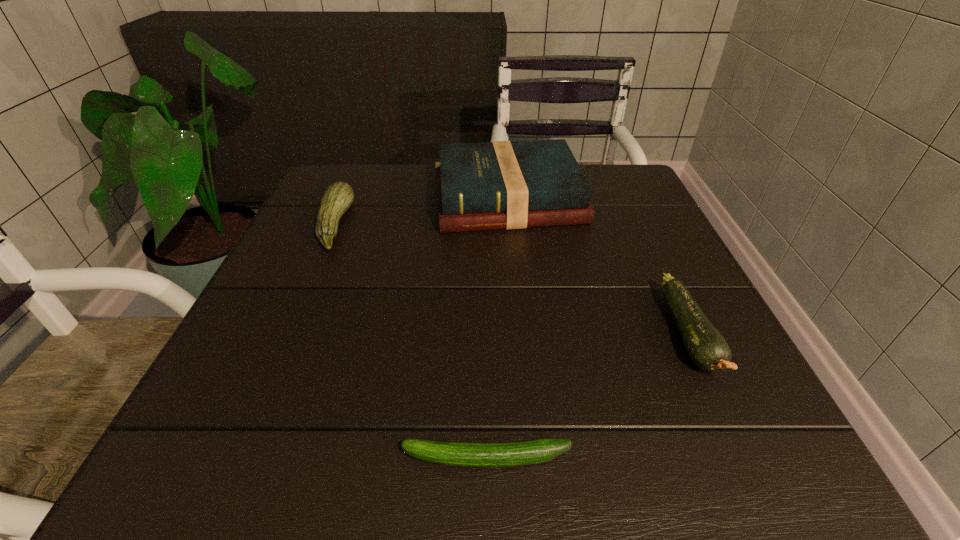
Locate an element on the screen. The height and width of the screenshot is (540, 960). blank region between the third farthest object and the hardback book is located at coordinates point(598,267).

The width and height of the screenshot is (960, 540). In order to click on empty space that is in between the shortest object and the hardback book in this screenshot , I will do `click(497, 328)`.

Where is `vacant space that is in between the tallest object and the rightmost zucchini`? This screenshot has width=960, height=540. vacant space that is in between the tallest object and the rightmost zucchini is located at coordinates (598, 267).

You are a GUI agent. You are given a task and a screenshot of the screen. Output one action in this format:
    pyautogui.click(x=<x>, y=<y>)
    Task: Click on the free space between the shortest zucchini and the leftmost zucchini
    
    Given the screenshot: What is the action you would take?
    pyautogui.click(x=411, y=341)

The height and width of the screenshot is (540, 960). I want to click on vacant area that lies between the second nearest object and the leftmost object, so click(512, 280).

Locate an element on the screen. The height and width of the screenshot is (540, 960). unoccupied position between the second nearest object and the nearest object is located at coordinates [x=588, y=396].

Find the location of `vacant area that lies between the leftmost object and the second zucchini from right to left`. vacant area that lies between the leftmost object and the second zucchini from right to left is located at coordinates (411, 341).

You are a GUI agent. You are given a task and a screenshot of the screen. Output one action in this format:
    pyautogui.click(x=<x>, y=<y>)
    Task: Click on the free point between the farthest zucchini and the shortest object
    This screenshot has height=540, width=960.
    Given the screenshot: What is the action you would take?
    pyautogui.click(x=411, y=341)

Find the location of a particular element. This screenshot has height=540, width=960. object that is the second closest one to the tallest object is located at coordinates (707, 348).

Point out which object is positioned as the nearest to the rightmost zucchini. Please provide its 2D coordinates. Your answer should be formatted as a tuple, i.e. [(x, y)], where the tuple contains the x and y coordinates of a point satisfying the conditions above.

[(493, 185)]